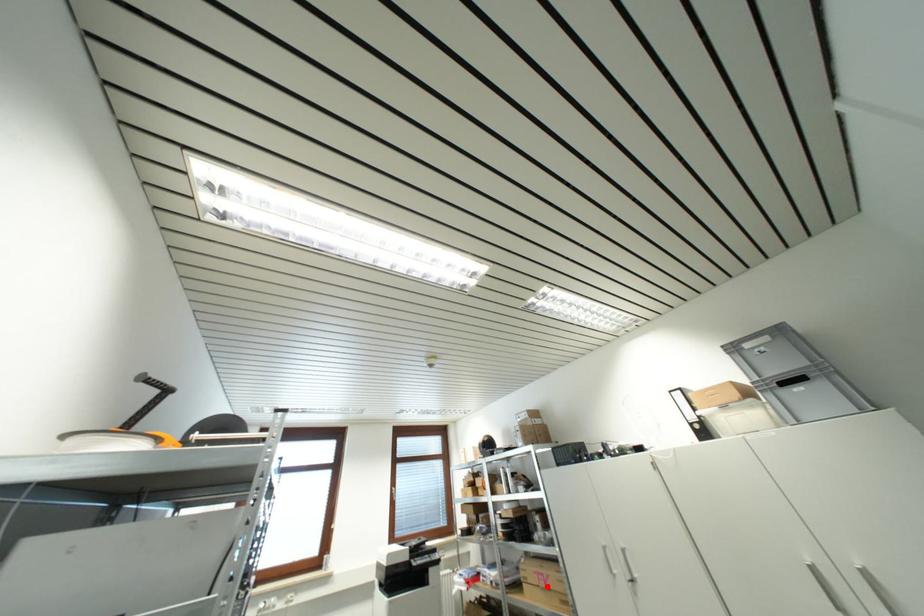
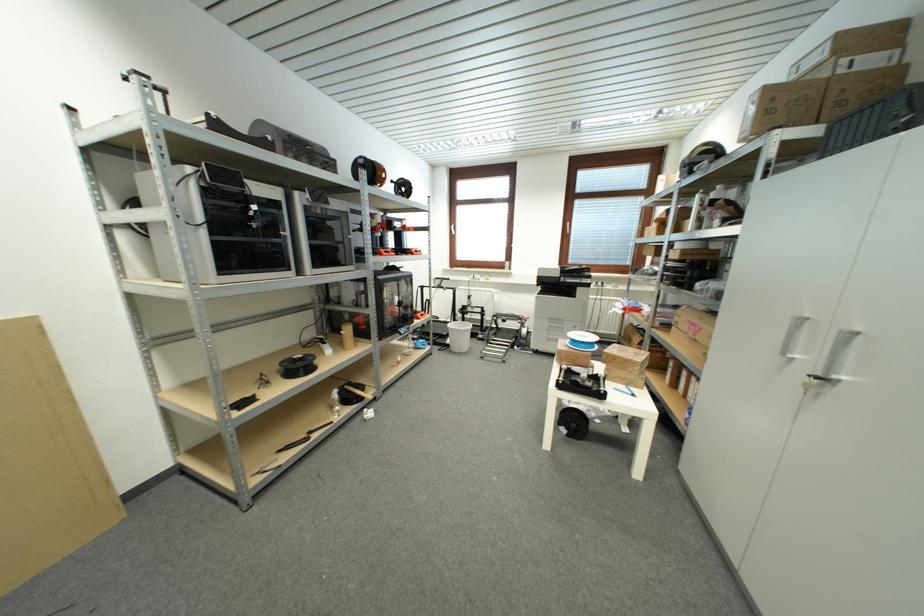
Where in the second image is the point corresponding to the highlighted location from the first image?

(696, 334)